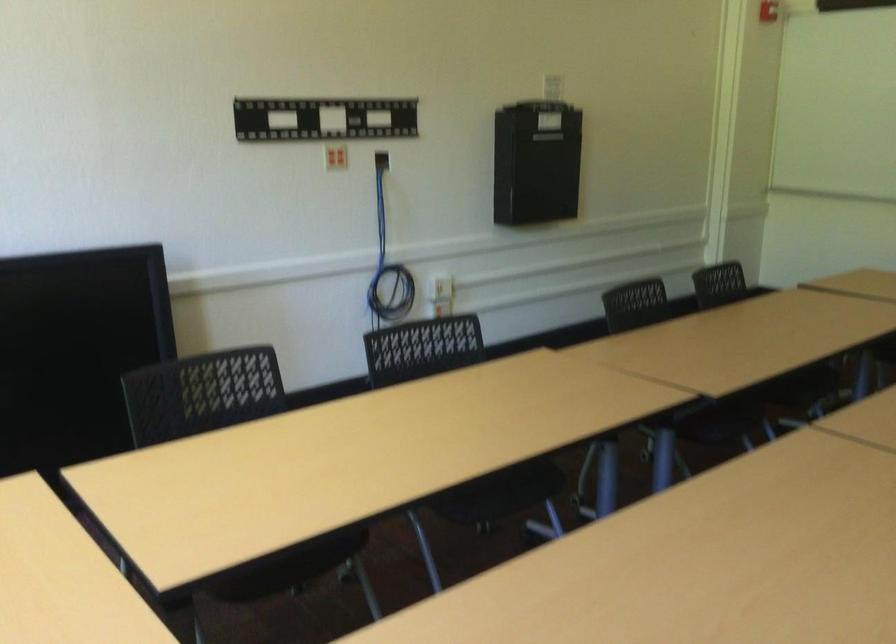
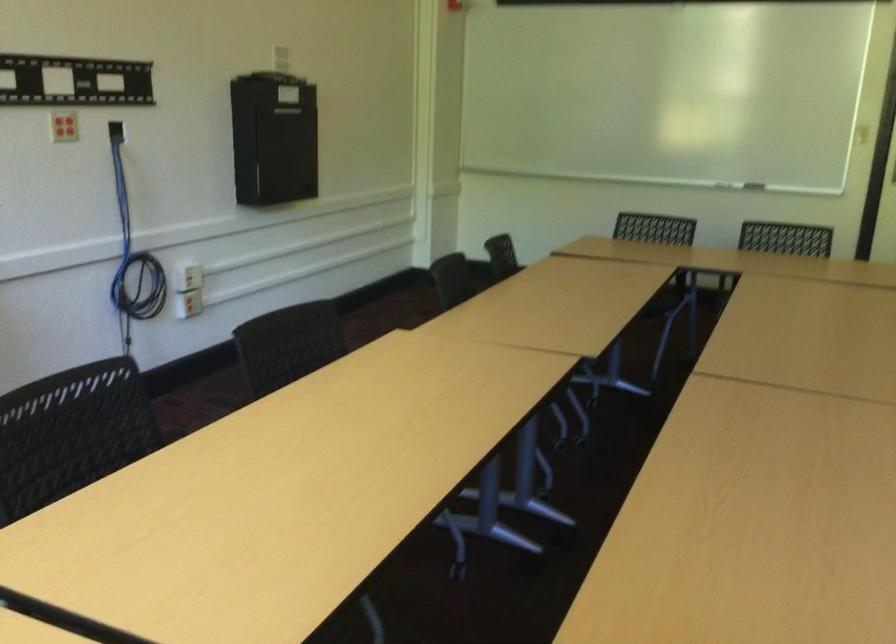
The images are taken continuously from a first-person perspective. In which direction are you moving?

The cameraman moved toward left, forward.